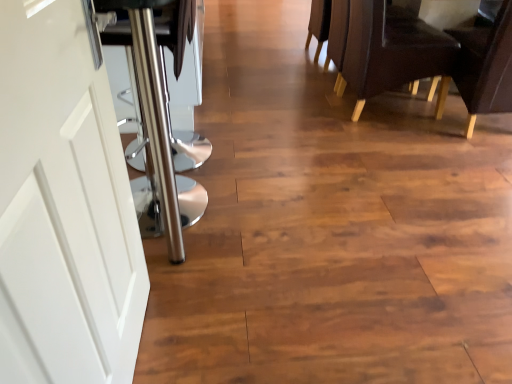
Identify the location of free space in front of leather-like dark brown chair at right, the 1th chair from the left. (381, 148).